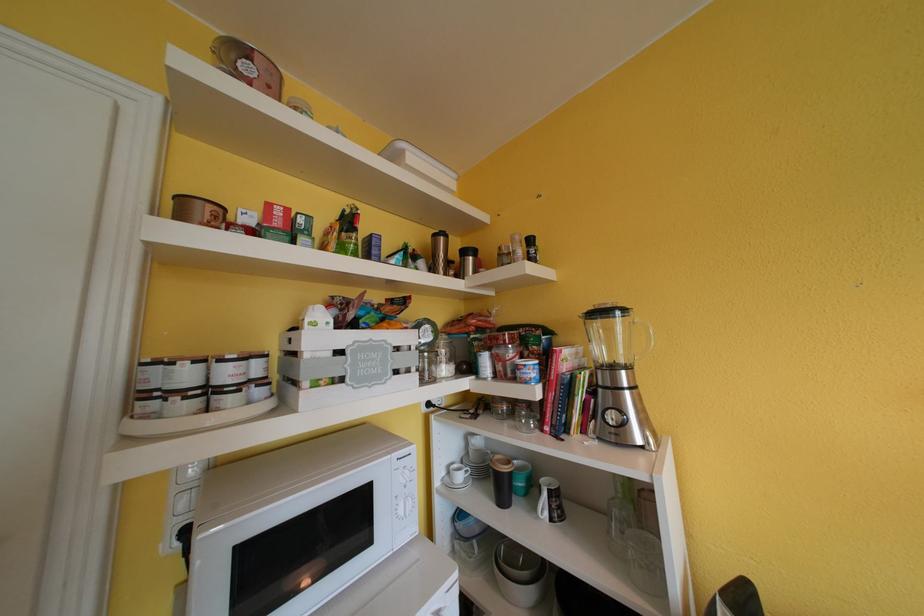
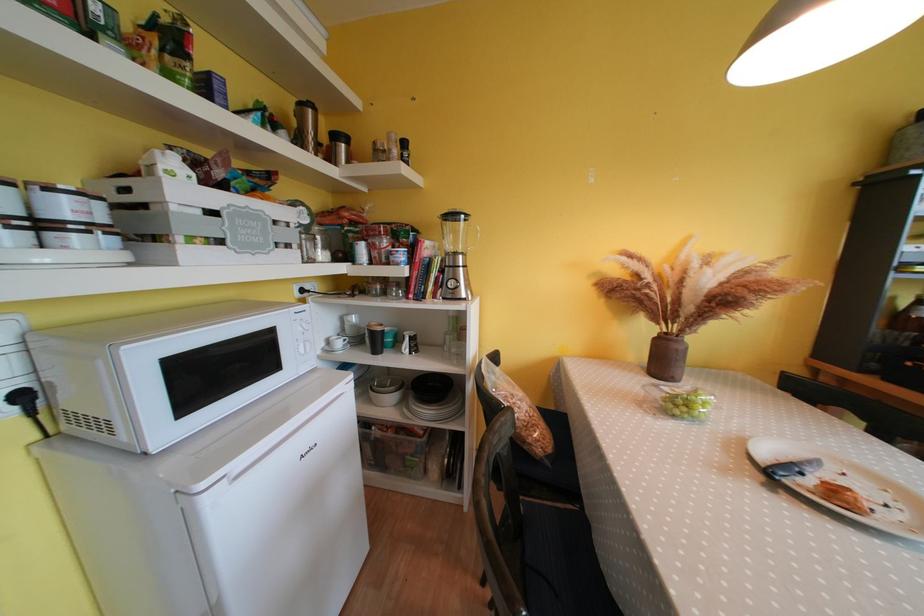
The point at (511, 565) is marked in the first image. Where is the corresponding point in the second image?

(383, 390)